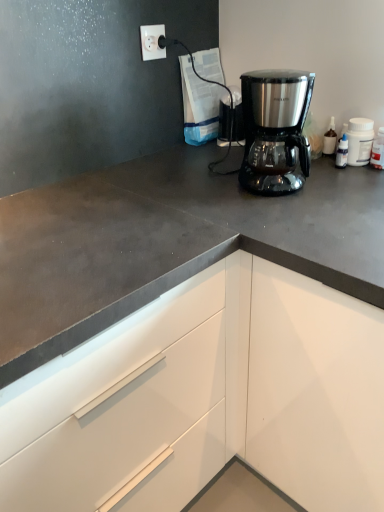
Question: Would you say white plastic bottle at upper right is inside or outside white plastic socket at upper left?

Choices:
 (A) inside
 (B) outside

Answer: (B)

Question: In terms of size, does white plastic bottle at upper right appear bigger or smaller than white plastic socket at upper left?

Choices:
 (A) big
 (B) small

Answer: (A)

Question: Which object is positioned farthest from the stainless steel coffee maker at center?

Choices:
 (A) white plastic bottle at upper right
 (B) white plastic socket at upper left

Answer: (B)

Question: Based on their relative distances, which object is farther from the stainless steel coffee maker at center?

Choices:
 (A) white plastic bottle at upper right
 (B) white plastic socket at upper left

Answer: (B)